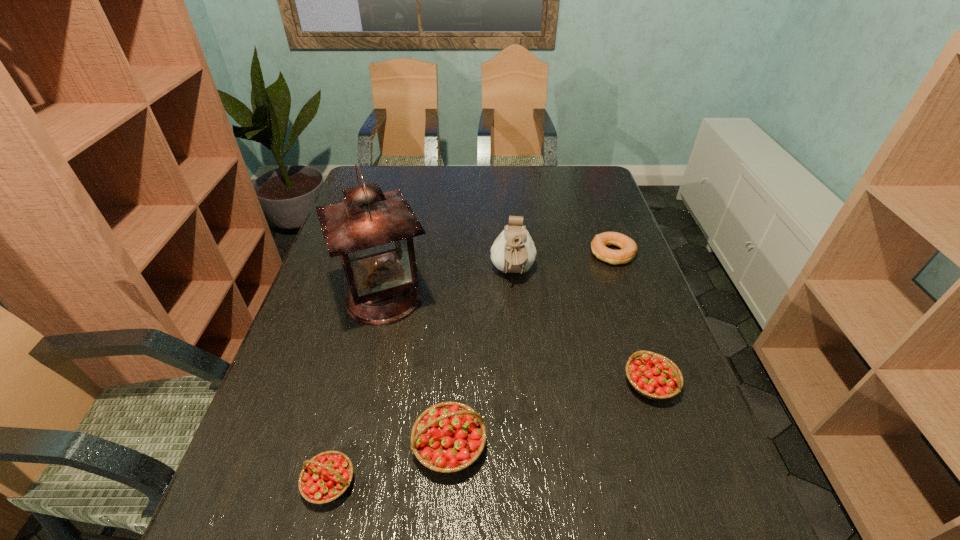
Please point a location where one more strawberry can be added evenly. Please provide its 2D coordinates. Your answer should be formatted as a tuple, i.e. [(x, y)], where the tuple contains the x and y coordinates of a point satisfying the conditions above.

[(556, 413)]